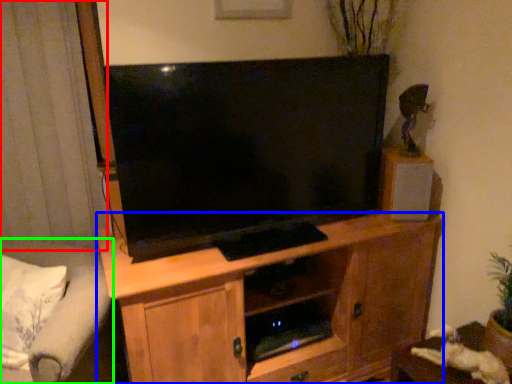
Question: Based on their relative distances, which object is farther from curtain (highlighted by a red box)? Choose from cabinetry (highlighted by a blue box) and studio couch (highlighted by a green box).

Choices:
 (A) cabinetry
 (B) studio couch

Answer: (A)